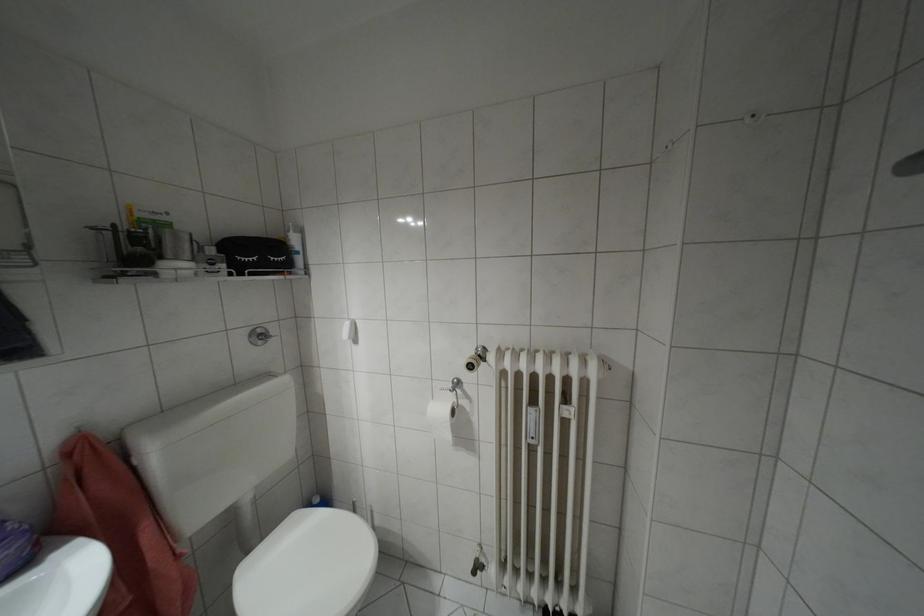
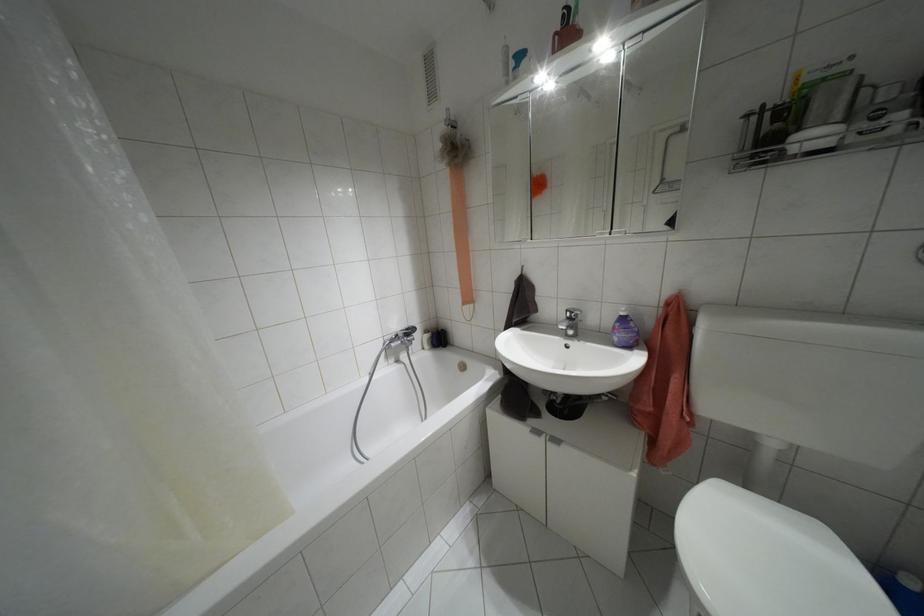
How did the camera likely rotate?

The camera's rotation is toward left-down.